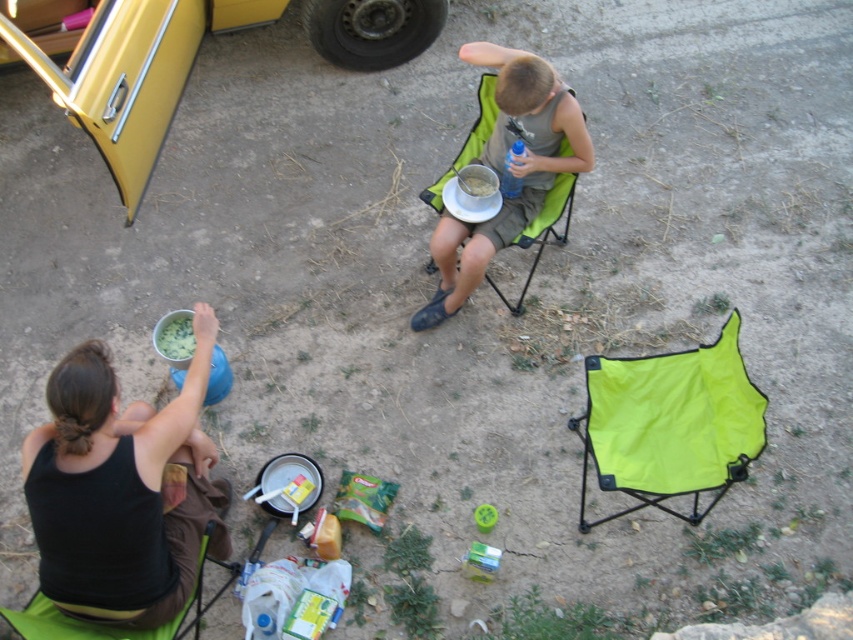
You are standing at the edge of the campsite and want to reach the neon green fabric folding chair at center to retrieve a jar of honey nearby. If you can walk 3 meters in 1 minute, how long will it take you to reach the chair?

The neon green fabric folding chair at center is 2.47 meters away from the viewer. Since you can walk 3 meters in 1 minute, it will take less than a minute to reach the chair.

You are standing at the edge of the scene and want to sit down on either the neon green fabric folding chair at center or the green fabric chair at lower left. Which chair is closer to you?

The neon green fabric folding chair at center is positioned over the green fabric chair at lower left, meaning it is closer to you.

You are standing at the origin point of the coordinate system in this scene. You need to place a new item at the coordinates given for the matte green chair at center. Where should you place the new item?

You should place the new item at the coordinates point (511, 168) where the matte green chair at center is located.